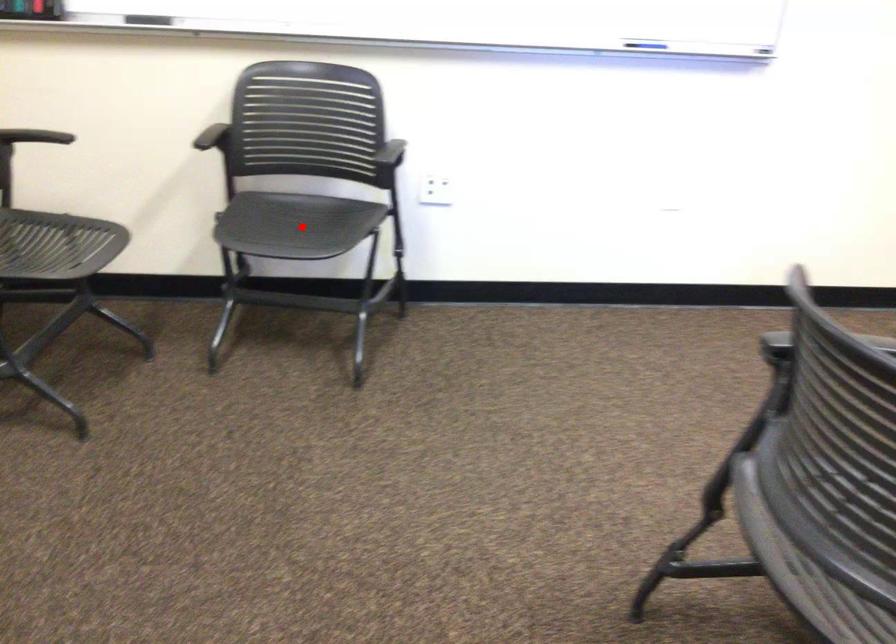
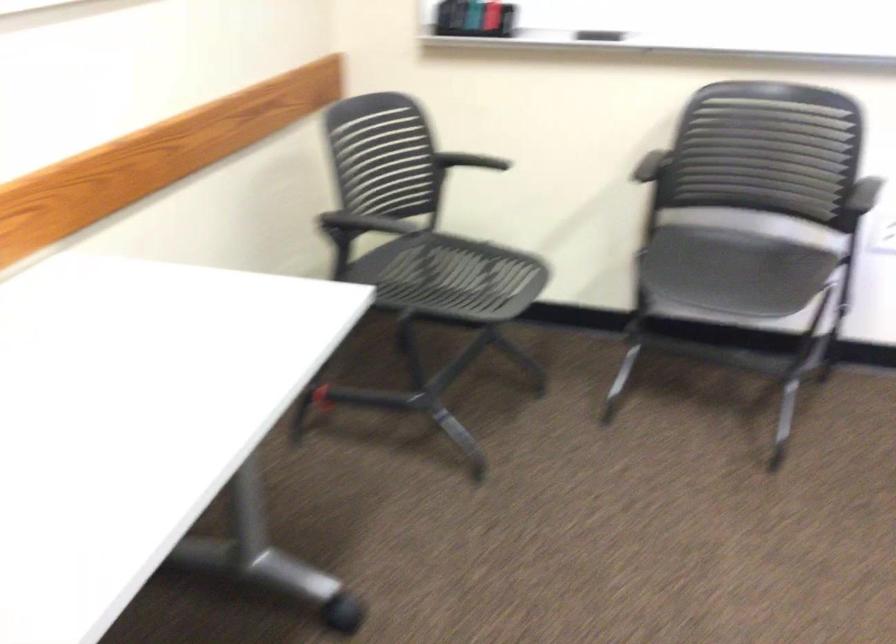
Question: I am providing you with two images of the same scene from different viewpoints. Image1 has a red point marked. In image2, the corresponding 3D location appears at what relative position? Reply with the corresponding letter.

Choices:
 (A) Closer
 (B) Farther

Answer: (A)